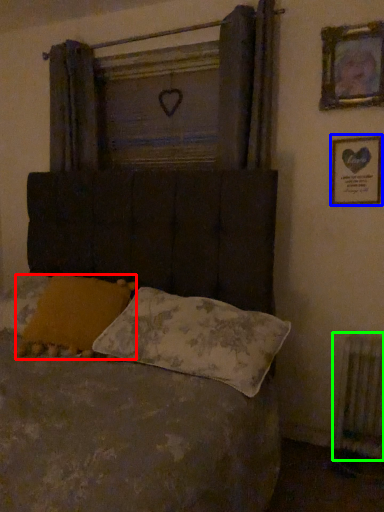
Question: Estimate the real-world distances between objects in this image. Which object is closer to pillow (highlighted by a red box), picture frame (highlighted by a blue box) or radiator (highlighted by a green box)?

Choices:
 (A) picture frame
 (B) radiator

Answer: (A)